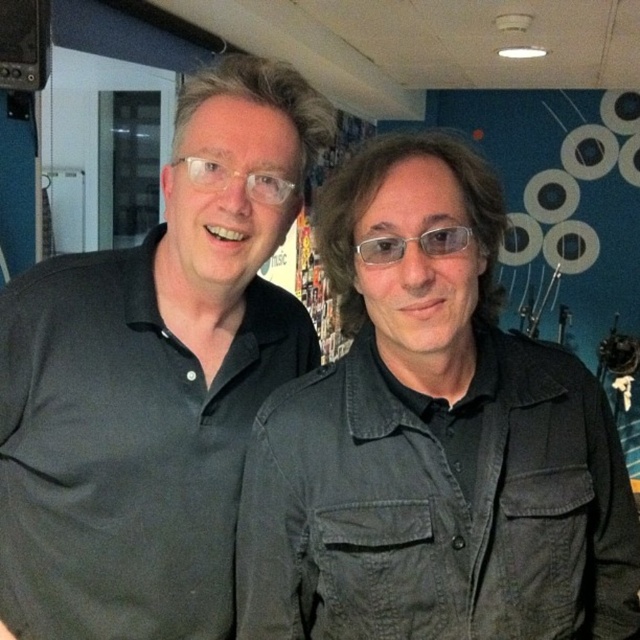
Question: Which object is closer to the camera taking this photo?

Choices:
 (A) clear plastic glasses at upper center
 (B) transparent plastic glasses at center

Answer: (B)

Question: Which point is closer to the camera taking this photo?

Choices:
 (A) (262, 179)
 (B) (445, 241)
 (C) (173, 364)
 (D) (248, 465)

Answer: (B)

Question: Does matte black jacket at center have a lesser width compared to transparent plastic glasses at center?

Choices:
 (A) no
 (B) yes

Answer: (A)

Question: Is clear plastic glasses at upper center closer to camera compared to transparent plastic glasses at center?

Choices:
 (A) no
 (B) yes

Answer: (A)

Question: Is clear plastic glasses at upper center below transparent plastic glasses at center?

Choices:
 (A) yes
 (B) no

Answer: (B)

Question: Which of the following is the farthest from the observer?

Choices:
 (A) (429, 252)
 (B) (230, 83)
 (C) (580, 552)
 (D) (244, 182)

Answer: (B)